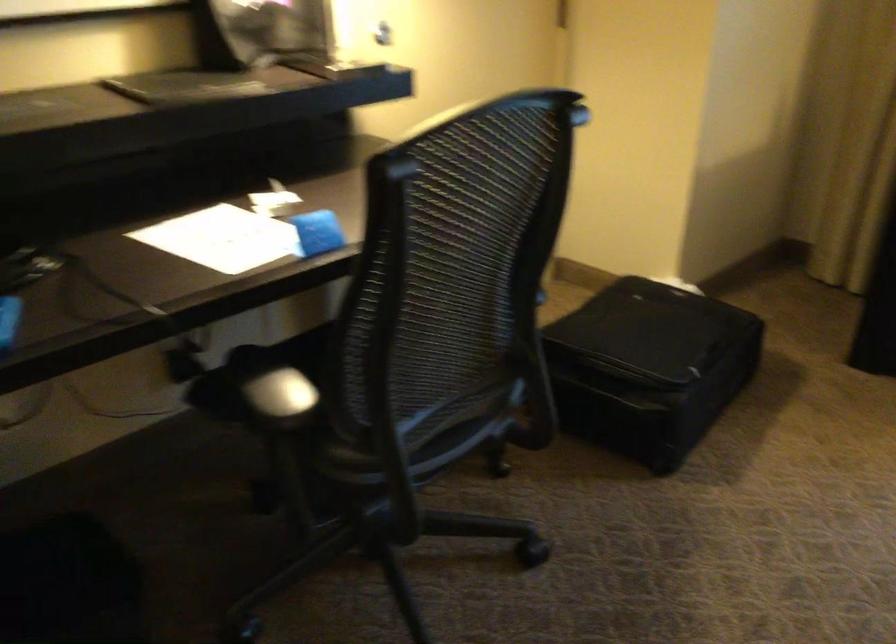
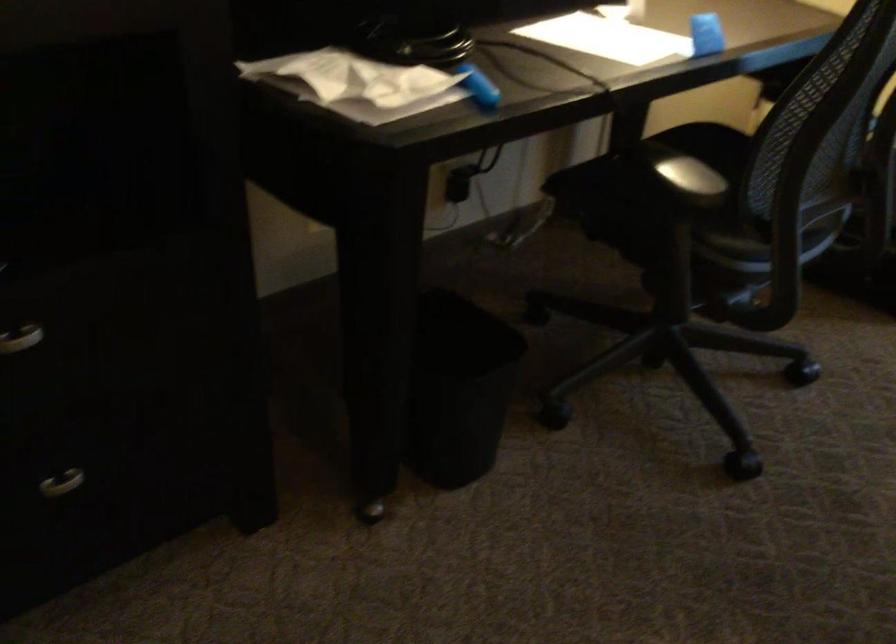
Question: The first image is from the beginning of the video and the second image is from the end. How did the camera likely rotate when shooting the video?

Choices:
 (A) Left
 (B) Right
 (C) Up
 (D) Down

Answer: (D)